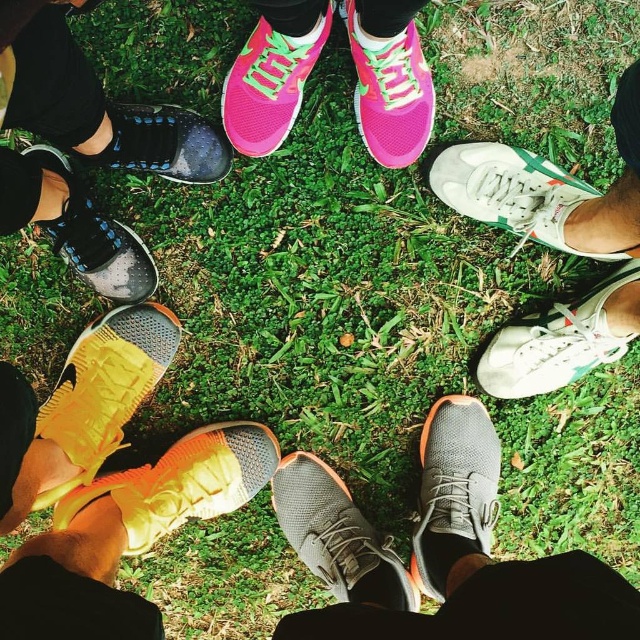
Who is taller, white leather sneakers at lower right or yellow mesh shoe at lower left?

With more height is white leather sneakers at lower right.

Between point (632, 269) and point (141, 372), which one is positioned in front?

Point (632, 269) is in front.

Locate an element on the screen. The width and height of the screenshot is (640, 640). white leather sneakers at lower right is located at coordinates (556, 248).

The width and height of the screenshot is (640, 640). Identify the location of yellow mesh shoe at lower left. (104, 387).

The width and height of the screenshot is (640, 640). Identify the location of yellow mesh shoe at lower left. (104, 387).

Find the location of a particular element. This screenshot has width=640, height=640. yellow mesh shoe at lower left is located at coordinates (104, 387).

Describe the element at coordinates (556, 248) in the screenshot. The image size is (640, 640). I see `white leather sneakers at lower right` at that location.

This screenshot has width=640, height=640. What do you see at coordinates (556, 248) in the screenshot? I see `white leather sneakers at lower right` at bounding box center [556, 248].

Where is `white leather sneakers at lower right`? The image size is (640, 640). white leather sneakers at lower right is located at coordinates (556, 248).